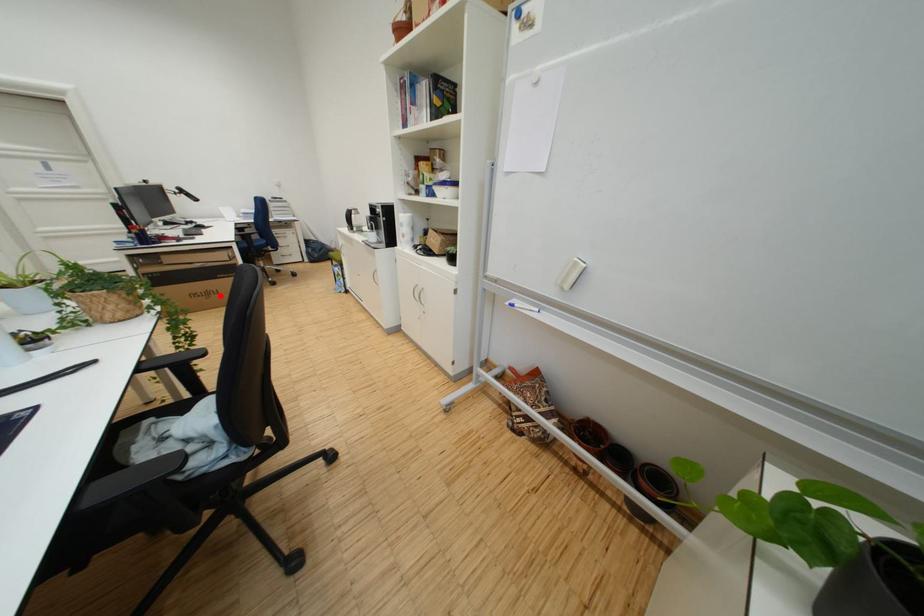
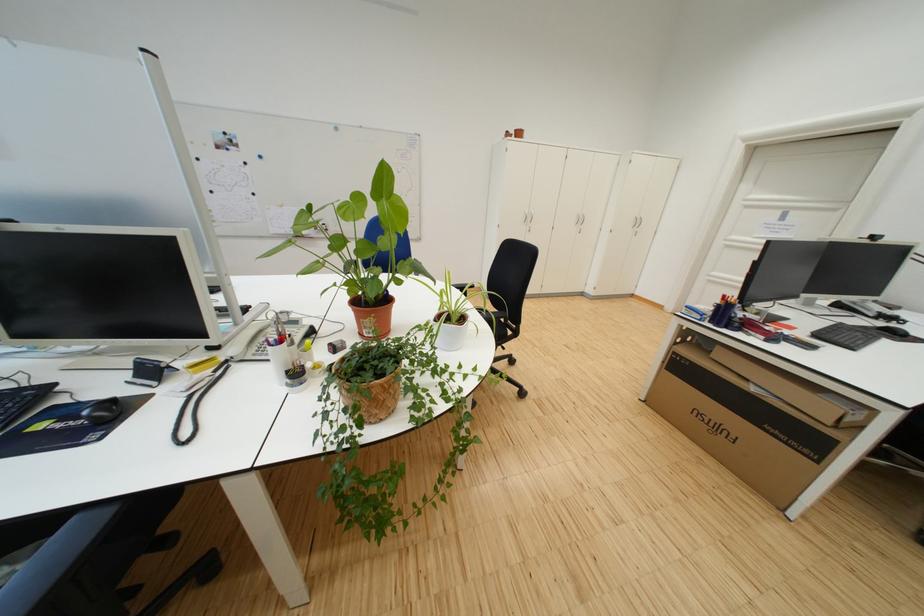
Find the pixel in the second image that matches the highlighted location in the first image.

(730, 431)